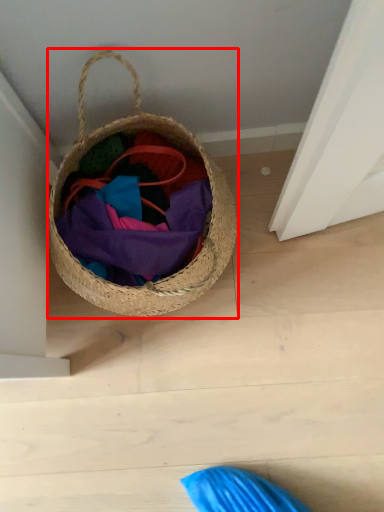
Question: In this image, where is picnic basket (annotated by the red box) located relative to bag?

Choices:
 (A) left
 (B) right

Answer: (A)